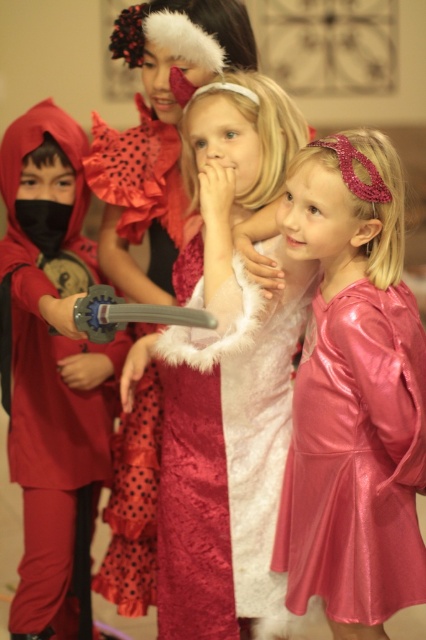
Question: Based on their relative distances, which object is nearer to the matte red costume at left?

Choices:
 (A) shiny pink dress at lower right
 (B) velvet maroon dress at center

Answer: (B)

Question: Is matte red costume at left to the left of shiny pink dress at lower right from the viewer's perspective?

Choices:
 (A) no
 (B) yes

Answer: (B)

Question: Based on their relative distances, which object is farther from the shiny pink dress at lower right?

Choices:
 (A) velvet maroon dress at center
 (B) matte red costume at left

Answer: (B)

Question: Does matte red costume at left appear over shiny pink dress at lower right?

Choices:
 (A) yes
 (B) no

Answer: (A)

Question: Which point is farther from the camera taking this photo?

Choices:
 (A) (382, 445)
 (B) (114, 385)

Answer: (B)

Question: Is matte red costume at left wider than shiny pink dress at lower right?

Choices:
 (A) yes
 (B) no

Answer: (A)